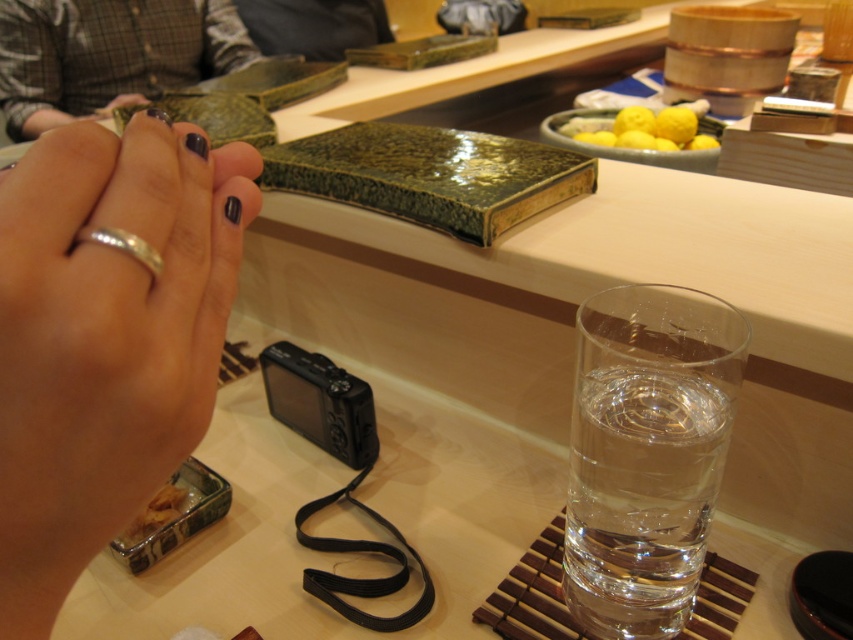
Question: Based on their relative distances, which object is farther from the clear glass water at right?

Choices:
 (A) nail polish at center
 (B) yellow matte lemons at upper center
 (C) matte plaid shirt at upper left
 (D) black rubber strap at lower center

Answer: (C)

Question: Can you confirm if clear glass water at right is wider than black rubber strap at lower center?

Choices:
 (A) yes
 (B) no

Answer: (B)

Question: Does matte plaid shirt at upper left lie in front of nail polish at center?

Choices:
 (A) no
 (B) yes

Answer: (A)

Question: Based on their relative distances, which object is farther from the yellow matte lemons at upper center?

Choices:
 (A) clear glass water at right
 (B) matte plaid shirt at upper left
 (C) silver metallic ring at lower left

Answer: (B)

Question: Which object appears farthest from the camera in this image?

Choices:
 (A) clear glass water at right
 (B) silver metallic ring at lower left
 (C) nail polish at center
 (D) matte plaid shirt at upper left

Answer: (D)

Question: Considering the relative positions of clear glass water at right and black rubber strap at lower center in the image provided, where is clear glass water at right located with respect to black rubber strap at lower center?

Choices:
 (A) above
 (B) below

Answer: (A)